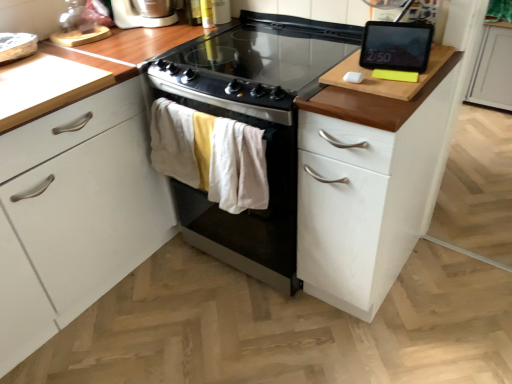
The image size is (512, 384). In order to click on free point in front of white wood cabinet at right in this screenshot , I will do `click(388, 343)`.